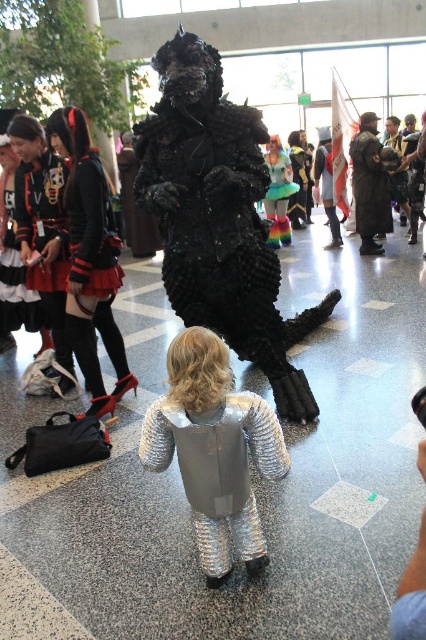
Question: Can you confirm if velvet black dress at left is positioned to the right of shiny silver armor at center?

Choices:
 (A) no
 (B) yes

Answer: (A)

Question: Among these points, which one is nearest to the camera?

Choices:
 (A) (161, 412)
 (B) (48, 116)
 (C) (276, 195)

Answer: (A)

Question: Can you confirm if velvet black dress at left is positioned above matte black dress at left?

Choices:
 (A) yes
 (B) no

Answer: (B)

Question: Is velvet black coat at center bigger than shiny teal figurine at center?

Choices:
 (A) yes
 (B) no

Answer: (B)

Question: Which object appears farthest from the camera in this image?

Choices:
 (A) shiny silver armor at center
 (B) shiny teal figurine at center
 (C) velvet black dress at left

Answer: (B)

Question: Which point is farther from the camera taking this photo?

Choices:
 (A) click(x=109, y=308)
 (B) click(x=69, y=264)
 (C) click(x=270, y=420)
 (D) click(x=365, y=161)

Answer: (D)